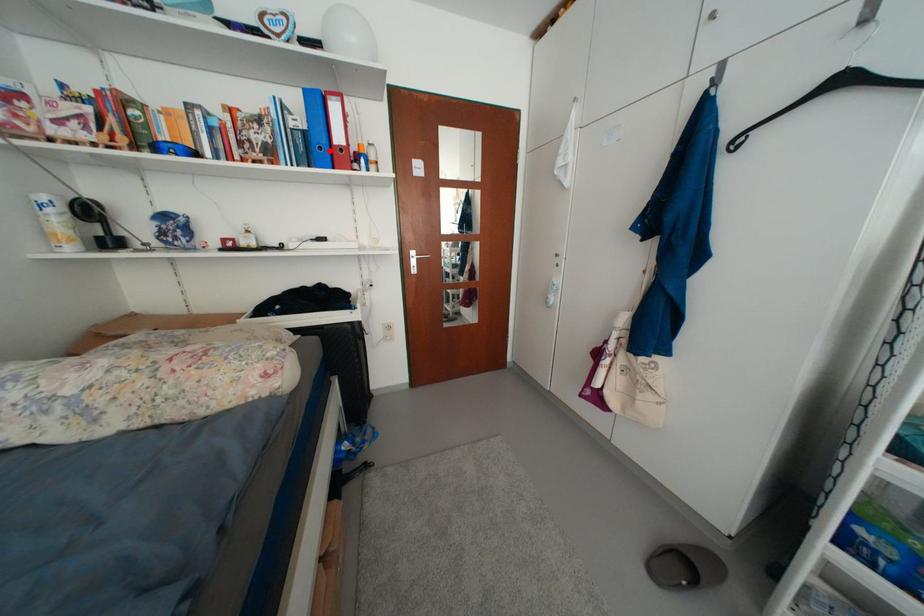
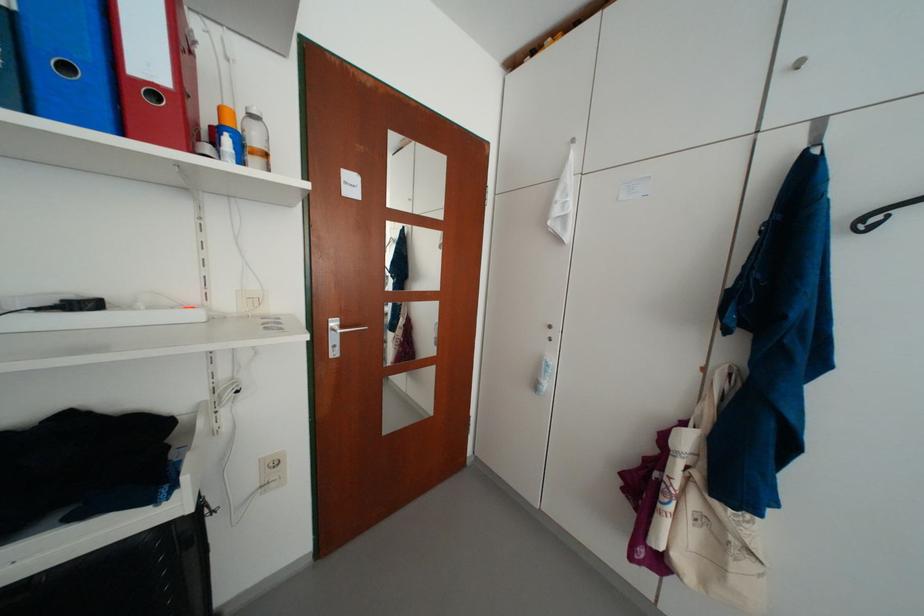
In the second image, find the point that corresponds to the highlighted location in the first image.

(76, 70)